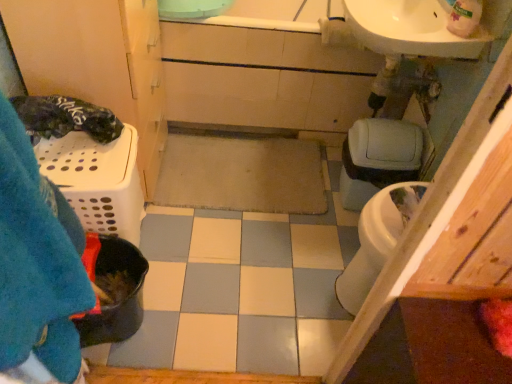
Measure the distance between point (434,2) and camera.

4.49 feet.

Describe the element at coordinates (97, 62) in the screenshot. The height and width of the screenshot is (384, 512). I see `white plastic laundry basket at left` at that location.

Image resolution: width=512 pixels, height=384 pixels. Describe the element at coordinates (378, 158) in the screenshot. I see `matte gray toilet bowl at right` at that location.

Describe the element at coordinates (38, 261) in the screenshot. I see `blue fuzzy blanket at left` at that location.

Locate an element on the screen. This screenshot has width=512, height=384. white glossy sink at upper right is located at coordinates (413, 28).

The image size is (512, 384). What are the coordinates of `bathroom cabinet positioned vertically above the matte gray toilet bowl at right (from a real-world perspective)` in the screenshot? It's located at (97, 62).

Is white plastic laundry basket at left wider or thinner than matte gray toilet bowl at right?

white plastic laundry basket at left is wider than matte gray toilet bowl at right.

From the image's perspective, is white plastic laundry basket at left located beneath matte gray toilet bowl at right?

Incorrect, from the image's perspective, white plastic laundry basket at left is higher than matte gray toilet bowl at right.

From the image's perspective, which is below, blue fuzzy blanket at left or white plastic laundry basket at left?

blue fuzzy blanket at left.

Is blue fuzzy blanket at left positioned far away from white plastic laundry basket at left?

No, blue fuzzy blanket at left is not far from white plastic laundry basket at left.

Considering the positions of points (90, 307) and (140, 28), is point (90, 307) closer to camera compared to point (140, 28)?

Yes, it is.

Is blue fuzzy blanket at left in front of or behind white plastic laundry basket at left in the image?

Clearly, blue fuzzy blanket at left is in front of white plastic laundry basket at left.

How different are the orientations of white plastic laundry basket at left and blue fuzzy blanket at left in degrees?

The angular difference between white plastic laundry basket at left and blue fuzzy blanket at left is 13.4 degrees.

Is white plastic laundry basket at left next to blue fuzzy blanket at left and touching it?

No.

Is white plastic laundry basket at left turned away from blue fuzzy blanket at left?

No, white plastic laundry basket at left is not facing the opposite direction of blue fuzzy blanket at left.

From the image's perspective, which is below, white plastic laundry basket at left or blue fuzzy blanket at left?

blue fuzzy blanket at left appears lower in the image.

Identify the location of toilet bowl directly beneath the blue fuzzy blanket at left (from a real-world perspective). (378, 158).

Which is in front, point (413, 170) or point (32, 166)?

Point (32, 166)

What's the angular difference between matte gray toilet bowl at right and blue fuzzy blanket at left's facing directions?

matte gray toilet bowl at right and blue fuzzy blanket at left are facing 106 degrees away from each other.

Considering the positions of objects matte gray toilet bowl at right and blue fuzzy blanket at left in the image provided, who is more to the right, matte gray toilet bowl at right or blue fuzzy blanket at left?

From the viewer's perspective, matte gray toilet bowl at right appears more on the right side.

From the image's perspective, is matte gray toilet bowl at right under white glossy sink at upper right?

Yes, from the image's perspective, matte gray toilet bowl at right is beneath white glossy sink at upper right.

Which of these two, matte gray toilet bowl at right or white glossy sink at upper right, stands shorter?

With less height is white glossy sink at upper right.

Find the location of a particular element. toilet bowl beneath the white glossy sink at upper right (from a real-world perspective) is located at coordinates (378, 158).

From a real-world perspective, is matte gray toilet bowl at right below white glossy sink at upper right?

Indeed, from a real-world perspective, matte gray toilet bowl at right is positioned beneath white glossy sink at upper right.

Is blue fuzzy blanket at left not close to white glossy sink at upper right?

Indeed, blue fuzzy blanket at left is not near white glossy sink at upper right.

Is point (24, 196) positioned in front of point (446, 12)?

Yes.

Image resolution: width=512 pixels, height=384 pixels. Find the location of `blanket in front of the white glossy sink at upper right`. blanket in front of the white glossy sink at upper right is located at coordinates (38, 261).

Is white glossy sink at upper right touching matte gray toilet bowl at right?

No, white glossy sink at upper right is not in contact with matte gray toilet bowl at right.

From the image's perspective, which is below, white glossy sink at upper right or matte gray toilet bowl at right?

matte gray toilet bowl at right, from the image's perspective.

Which of these two, white glossy sink at upper right or matte gray toilet bowl at right, is thinner?

Thinner between the two is matte gray toilet bowl at right.

Image resolution: width=512 pixels, height=384 pixels. I want to click on bathroom cabinet above the matte gray toilet bowl at right (from the image's perspective), so click(x=97, y=62).

Find the location of a particular element. The height and width of the screenshot is (384, 512). bathroom cabinet below the blue fuzzy blanket at left (from a real-world perspective) is located at coordinates (97, 62).

Which object lies nearer to the anchor point blue fuzzy blanket at left, white glossy sink at upper right or white plastic laundry basket at left?

white plastic laundry basket at left.

Looking at this image, based on their spatial positions, is white plastic laundry basket at left or blue fuzzy blanket at left further from matte gray toilet bowl at right?

Based on the image, blue fuzzy blanket at left appears to be further to matte gray toilet bowl at right.

Which object lies further to the anchor point white glossy sink at upper right, blue fuzzy blanket at left or white plastic laundry basket at left?

Based on the image, blue fuzzy blanket at left appears to be further to white glossy sink at upper right.

Which object lies nearer to the anchor point white plastic laundry basket at left, matte gray toilet bowl at right or white glossy sink at upper right?

white glossy sink at upper right.

Estimate the real-world distances between objects in this image. Which object is closer to matte gray toilet bowl at right, blue fuzzy blanket at left or white plastic laundry basket at left?

white plastic laundry basket at left.

Looking at the image, which one is located closer to white plastic laundry basket at left, blue fuzzy blanket at left or white glossy sink at upper right?

white glossy sink at upper right.

Which object lies nearer to the anchor point blue fuzzy blanket at left, white plastic laundry basket at left or white glossy sink at upper right?

Based on the image, white plastic laundry basket at left appears to be nearer to blue fuzzy blanket at left.

When comparing their distances from blue fuzzy blanket at left, does white plastic laundry basket at left or matte gray toilet bowl at right seem closer?

white plastic laundry basket at left lies closer to blue fuzzy blanket at left than the other object.

Locate an element on the screen. sink located between white plastic laundry basket at left and matte gray toilet bowl at right in the left-right direction is located at coordinates (413, 28).

At what (x,y) coordinates should I click in order to perform the action: click on sink located between blue fuzzy blanket at left and matte gray toilet bowl at right in the depth direction. Please return your answer as a coordinate pair (x, y). Image resolution: width=512 pixels, height=384 pixels. Looking at the image, I should click on (413, 28).

Where is `bathroom cabinet between blue fuzzy blanket at left and matte gray toilet bowl at right in the front-back direction`? bathroom cabinet between blue fuzzy blanket at left and matte gray toilet bowl at right in the front-back direction is located at coordinates (97, 62).

At what (x,y) coordinates should I click in order to perform the action: click on bathroom cabinet located between blue fuzzy blanket at left and white glossy sink at upper right in the depth direction. Please return your answer as a coordinate pair (x, y). Looking at the image, I should click on (97, 62).